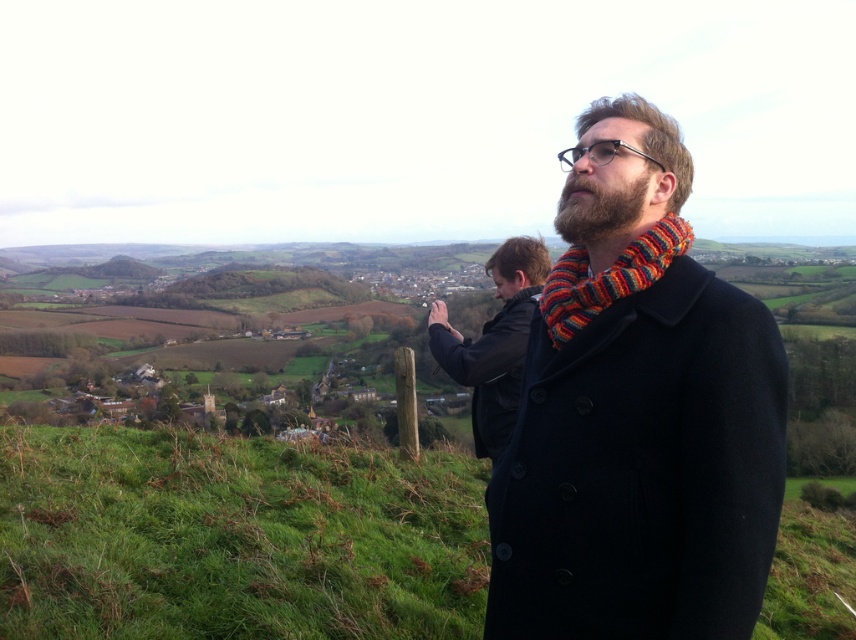
You are a photographer trying to capture a closeup of the black leather jacket at center and the dark brown beard at center. Since your camera has a limited focus range, which object should you focus on to ensure both are in focus?

The black leather jacket at center is bigger than the dark brown beard at center, so focusing on the black leather jacket at center will ensure both are within the focus range.

You are standing on the hilltop and want to take a photo of both the knitted wool scarf at center and the knitted multicolor scarf at right. Which scarf should you focus on first to ensure both are in the frame?

You should focus on the knitted multicolor scarf at right first because the knitted wool scarf at center is below it, so adjusting the camera angle to include the higher positioned scarf will naturally include the lower one in the frame.

You are a photographer trying to capture both the knitted wool scarf at center and the knitted multicolor scarf at right in a single frame. Which scarf will appear taller in the photo?

The knitted wool scarf at center will appear taller in the photo because it has a greater height compared to the knitted multicolor scarf at right.